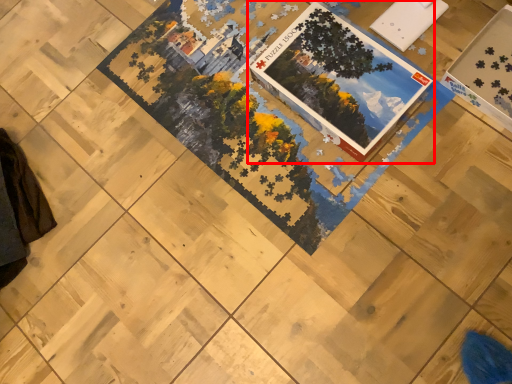
Question: From the image's perspective, what is the correct spatial relationship of book (annotated by the red box) in relation to square?

Choices:
 (A) above
 (B) below

Answer: (B)